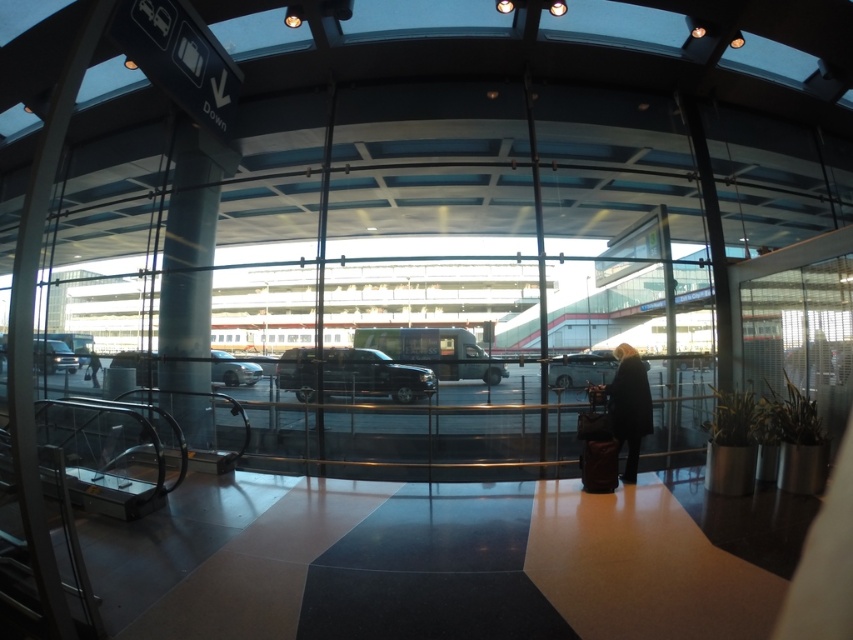
Question: Which of the following is the farthest from the observer?

Choices:
 (A) silver metallic car at center
 (B) shiny silver sedan at center

Answer: (B)

Question: Can you confirm if silver metallic car at center is wider than metallic silver van at left?

Choices:
 (A) no
 (B) yes

Answer: (A)

Question: Which object is positioned closest to the silver metallic car at center?

Choices:
 (A) metallic silver van at left
 (B) dark brown leather suitcase at lower right

Answer: (A)

Question: Is metallic silver van at center behind dark gray jacket at lower center?

Choices:
 (A) no
 (B) yes

Answer: (A)

Question: Can you confirm if black glossy suv at center is thinner than metallic silver van at center?

Choices:
 (A) yes
 (B) no

Answer: (B)

Question: Which is farther from the metallic silver van at center?

Choices:
 (A) shiny silver sedan at center
 (B) black glossy suv at center
 (C) matte black suitcase at center

Answer: (A)